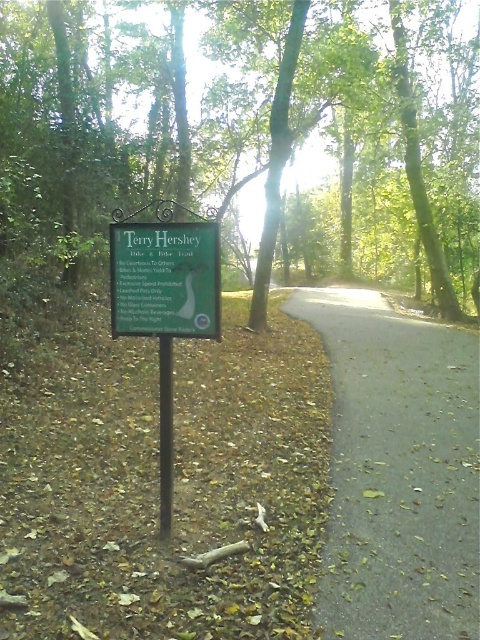
Question: Considering the real-world distances, which object is closest to the green wood sign at center?

Choices:
 (A) green matte signpost at center
 (B) gray asphalt road at center

Answer: (A)

Question: Considering the relative positions of gray asphalt road at center and green matte signpost at center in the image provided, where is gray asphalt road at center located with respect to green matte signpost at center?

Choices:
 (A) right
 (B) left

Answer: (A)

Question: Can you confirm if green leafy tree at center is positioned above gray asphalt road at center?

Choices:
 (A) yes
 (B) no

Answer: (A)

Question: Which point is closer to the camera taking this photo?

Choices:
 (A) (363, 584)
 (B) (466, 182)
 (C) (139, 252)
 (D) (162, 332)

Answer: (A)

Question: In this image, where is green leafy tree at center located relative to green matte signpost at center?

Choices:
 (A) right
 (B) left

Answer: (A)

Question: Which object is positioned farthest from the green leafy tree at center?

Choices:
 (A) gray asphalt road at center
 (B) green matte signpost at center
 (C) green wood sign at center

Answer: (B)